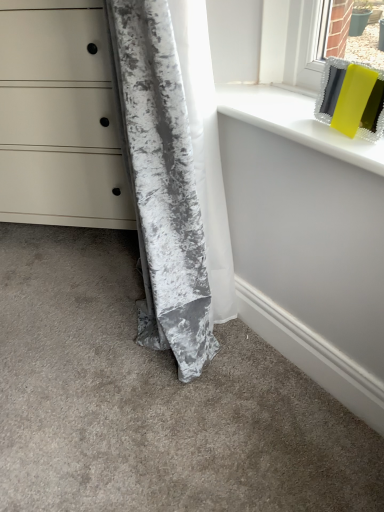
Locate an element on the screen. This screenshot has width=384, height=512. crushed velvet curtain at lower left is located at coordinates (162, 185).

Locate an element on the screen. crushed velvet curtain at lower left is located at coordinates (162, 185).

In the scene shown: Which object is positioned more to the left, white glossy window sill at upper right or matte white chest of drawers at lower left?

Positioned to the left is matte white chest of drawers at lower left.

Is white glossy window sill at upper right oriented towards matte white chest of drawers at lower left?

No, white glossy window sill at upper right is not aimed at matte white chest of drawers at lower left.

From the image's perspective, is white glossy window sill at upper right positioned above or below matte white chest of drawers at lower left?

Clearly, from the image's perspective, white glossy window sill at upper right is below matte white chest of drawers at lower left.

Is white glossy window sill at upper right positioned before matte white chest of drawers at lower left?

That is True.

Which point is more forward, (102, 26) or (266, 95)?

The point (266, 95) is in front.

Measure the distance between matte white chest of drawers at lower left and white glossy window sill at upper right.

A distance of 67.48 centimeters exists between matte white chest of drawers at lower left and white glossy window sill at upper right.

In order to click on window sill above the matte white chest of drawers at lower left (from a real-world perspective) in this screenshot , I will do [x=297, y=122].

Which of these two, matte white chest of drawers at lower left or white glossy window sill at upper right, stands shorter?

white glossy window sill at upper right is shorter.

Is matte white chest of drawers at lower left spatially inside crushed velvet curtain at lower left, or outside of it?

matte white chest of drawers at lower left is not inside crushed velvet curtain at lower left, it's outside.

Does matte white chest of drawers at lower left have a smaller size compared to crushed velvet curtain at lower left?

Incorrect, matte white chest of drawers at lower left is not smaller in size than crushed velvet curtain at lower left.

From a real-world perspective, is matte white chest of drawers at lower left above or below crushed velvet curtain at lower left?

Clearly, from a real-world perspective, matte white chest of drawers at lower left is below crushed velvet curtain at lower left.

Is matte white chest of drawers at lower left not near crushed velvet curtain at lower left?

They are positioned close to each other.

Consider the image. Between crushed velvet curtain at lower left and matte white chest of drawers at lower left, which one appears on the right side from the viewer's perspective?

From the viewer's perspective, crushed velvet curtain at lower left appears more on the right side.

Between crushed velvet curtain at lower left and matte white chest of drawers at lower left, which one has smaller width?

crushed velvet curtain at lower left is thinner.

Considering the positions of objects crushed velvet curtain at lower left and matte white chest of drawers at lower left in the image provided, who is in front, crushed velvet curtain at lower left or matte white chest of drawers at lower left?

crushed velvet curtain at lower left is closer to the camera.

Can you confirm if crushed velvet curtain at lower left is smaller than matte white chest of drawers at lower left?

Correct, crushed velvet curtain at lower left occupies less space than matte white chest of drawers at lower left.

Could you tell me if crushed velvet curtain at lower left is turned towards white glossy window sill at upper right?

Yes, crushed velvet curtain at lower left is aimed at white glossy window sill at upper right.

Consider the image. Which object is closer to the camera taking this photo, crushed velvet curtain at lower left or white glossy window sill at upper right?

crushed velvet curtain at lower left is closer to the camera.

From the picture: Considering the sizes of objects crushed velvet curtain at lower left and white glossy window sill at upper right in the image provided, who is bigger, crushed velvet curtain at lower left or white glossy window sill at upper right?

Bigger between the two is crushed velvet curtain at lower left.

Is white glossy window sill at upper right in front of crushed velvet curtain at lower left?

No, it is behind crushed velvet curtain at lower left.

Would you consider white glossy window sill at upper right to be distant from crushed velvet curtain at lower left?

No.

From the image's perspective, between white glossy window sill at upper right and crushed velvet curtain at lower left, which one is located above?

white glossy window sill at upper right.

The width and height of the screenshot is (384, 512). I want to click on window sill above the matte white chest of drawers at lower left (from a real-world perspective), so click(x=297, y=122).

Image resolution: width=384 pixels, height=512 pixels. I want to click on the chest of drawers that appears behind the white glossy window sill at upper right, so click(x=59, y=120).

When comparing their distances from white glossy window sill at upper right, does matte white chest of drawers at lower left or crushed velvet curtain at lower left seem further?

Based on the image, matte white chest of drawers at lower left appears to be further to white glossy window sill at upper right.

From the image, which object appears to be nearer to matte white chest of drawers at lower left, crushed velvet curtain at lower left or white glossy window sill at upper right?

crushed velvet curtain at lower left.

Estimate the real-world distances between objects in this image. Which object is closer to matte white chest of drawers at lower left, white glossy window sill at upper right or crushed velvet curtain at lower left?

The object closer to matte white chest of drawers at lower left is crushed velvet curtain at lower left.

Estimate the real-world distances between objects in this image. Which object is further from white glossy window sill at upper right, crushed velvet curtain at lower left or matte white chest of drawers at lower left?

Based on the image, matte white chest of drawers at lower left appears to be further to white glossy window sill at upper right.

Estimate the real-world distances between objects in this image. Which object is further from crushed velvet curtain at lower left, white glossy window sill at upper right or matte white chest of drawers at lower left?

matte white chest of drawers at lower left.

From the image, which object appears to be farther from crushed velvet curtain at lower left, matte white chest of drawers at lower left or white glossy window sill at upper right?

matte white chest of drawers at lower left lies further to crushed velvet curtain at lower left than the other object.

You are a GUI agent. You are given a task and a screenshot of the screen. Output one action in this format:
    pyautogui.click(x=<x>, y=<y>)
    Task: Click on the curtain located between matte white chest of drawers at lower left and white glossy window sill at upper right in the left-right direction
    The image size is (384, 512).
    Given the screenshot: What is the action you would take?
    pyautogui.click(x=162, y=185)